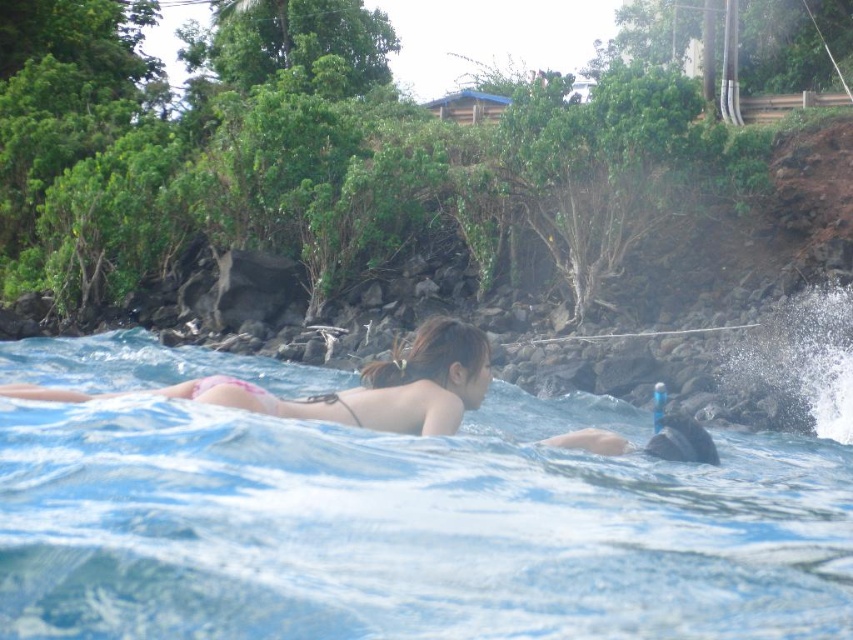
Question: Among these objects, which one is farthest from the camera?

Choices:
 (A) clear blue water at center
 (B) pink bikini at center

Answer: (B)

Question: Among these points, which one is farthest from the camera?

Choices:
 (A) [x=466, y=333]
 (B) [x=456, y=616]

Answer: (A)

Question: Which point is farther to the camera?

Choices:
 (A) clear blue water at center
 (B) pink bikini at center

Answer: (B)

Question: Where is clear blue water at center located in relation to pink bikini at center in the image?

Choices:
 (A) above
 (B) below

Answer: (B)

Question: Does clear blue water at center have a greater width compared to pink bikini at center?

Choices:
 (A) yes
 (B) no

Answer: (A)

Question: From the image, what is the correct spatial relationship of clear blue water at center in relation to pink bikini at center?

Choices:
 (A) left
 (B) right

Answer: (A)